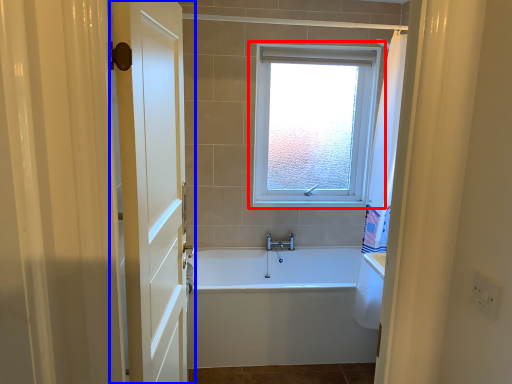
Question: Which point is further to the camera, window (highlighted by a red box) or door (highlighted by a blue box)?

Choices:
 (A) window
 (B) door

Answer: (A)